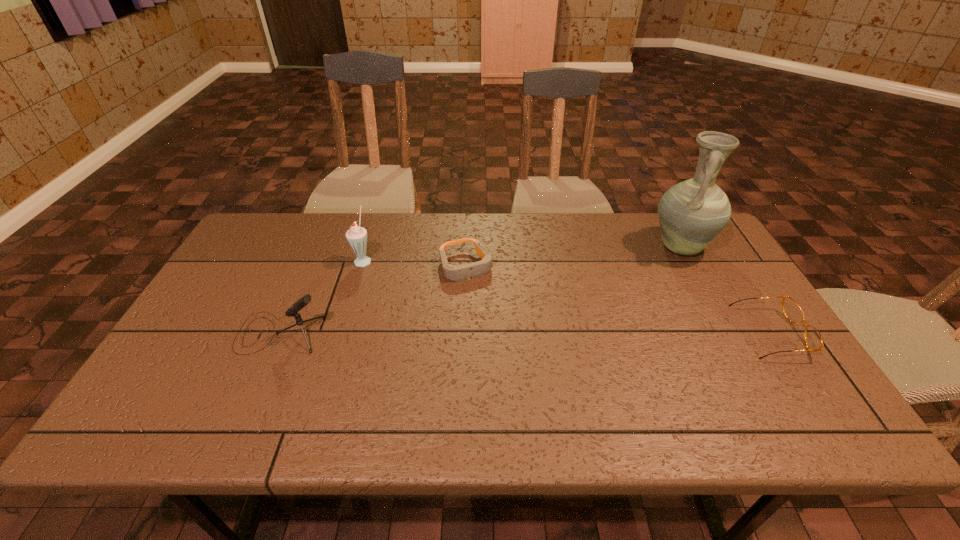
This screenshot has width=960, height=540. What are the coordinates of `vacant point located on the handle side of the pitcher` in the screenshot? It's located at (622, 294).

Image resolution: width=960 pixels, height=540 pixels. Find the location of `free space located on the handle side of the pitcher`. free space located on the handle side of the pitcher is located at coordinates (615, 299).

I want to click on vacant area situated 0.380m on the straw side of the second object from left to right, so point(476,313).

At what (x,y) coordinates should I click in order to perform the action: click on vacant space located on the straw side of the second object from left to right. Please return your answer as a coordinate pair (x, y). This screenshot has width=960, height=540. Looking at the image, I should click on (483, 316).

At what (x,y) coordinates should I click in order to perform the action: click on free region located on the straw side of the second object from left to right. Please return your answer as a coordinate pair (x, y). Looking at the image, I should click on (404, 280).

You are a GUI agent. You are given a task and a screenshot of the screen. Output one action in this format:
    pyautogui.click(x=<x>, y=<y>)
    Task: Click on the vacant area situated 0.080m on the front and back of the third object from right to left
    This screenshot has height=540, width=960.
    Given the screenshot: What is the action you would take?
    pyautogui.click(x=484, y=300)

This screenshot has width=960, height=540. What are the coordinates of `vacant space situated on the front and back of the third object from right to left` in the screenshot? It's located at (527, 383).

At what (x,y) coordinates should I click in order to perform the action: click on free region located 0.200m on the front and back of the third object from right to left. Please return your answer as a coordinate pair (x, y). Image resolution: width=960 pixels, height=540 pixels. Looking at the image, I should click on point(500,330).

I want to click on pitcher situated at the far edge, so click(x=691, y=213).

At what (x,y) coordinates should I click in order to perform the action: click on milkshake at the far edge. Please return your answer as a coordinate pair (x, y). The width and height of the screenshot is (960, 540). Looking at the image, I should click on (356, 236).